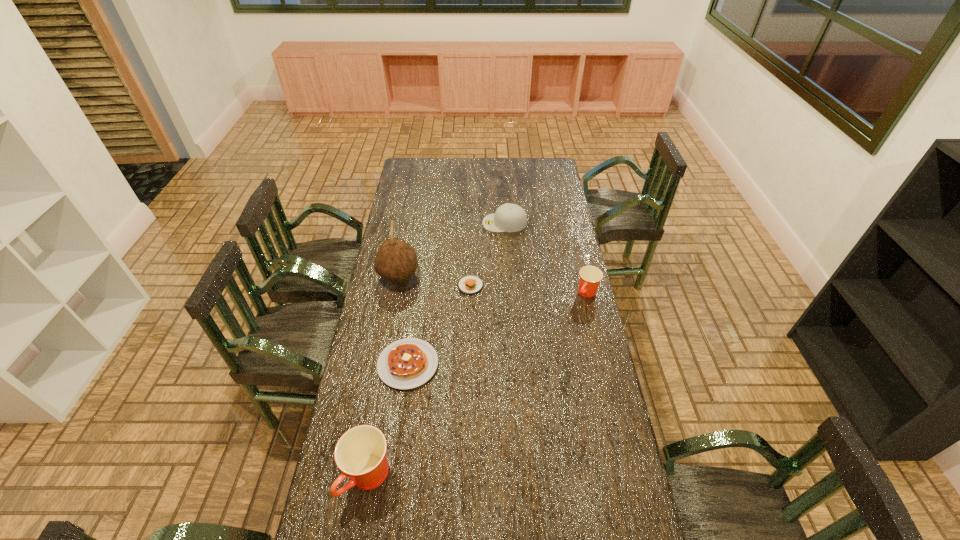
At what (x,y) coordinates should I click in order to perform the action: click on vacant spot for a new cup to ensure equal spacing. Please return your answer as a coordinate pair (x, y). Image resolution: width=960 pixels, height=540 pixels. Looking at the image, I should click on (496, 370).